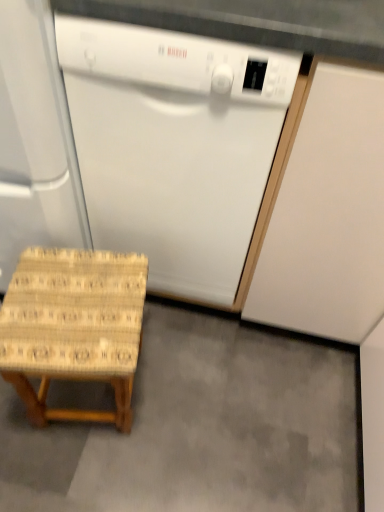
Question: Considering the relative sizes of woven wood stool at lower left and woven wood stool at lower left in the image provided, is woven wood stool at lower left taller than woven wood stool at lower left?

Choices:
 (A) no
 (B) yes

Answer: (B)

Question: Could you tell me if woven wood stool at lower left is facing woven wood stool at lower left?

Choices:
 (A) yes
 (B) no

Answer: (B)

Question: Is woven wood stool at lower left smaller than woven wood stool at lower left?

Choices:
 (A) yes
 (B) no

Answer: (B)

Question: Is woven wood stool at lower left placed right next to woven wood stool at lower left?

Choices:
 (A) yes
 (B) no

Answer: (B)

Question: Can we say woven wood stool at lower left lies outside woven wood stool at lower left?

Choices:
 (A) no
 (B) yes

Answer: (B)

Question: Is white matte dishwasher at left in front of or behind woven wood stool at lower left in the image?

Choices:
 (A) behind
 (B) front

Answer: (B)

Question: Is point (6, 118) positioned closer to the camera than point (44, 387)?

Choices:
 (A) farther
 (B) closer

Answer: (B)

Question: From a real-world perspective, is white matte dishwasher at left positioned above or below woven wood stool at lower left?

Choices:
 (A) above
 (B) below

Answer: (A)

Question: Looking at the image, does white matte dishwasher at left seem bigger or smaller compared to woven wood stool at lower left?

Choices:
 (A) big
 (B) small

Answer: (A)

Question: Looking at their shapes, would you say woven wood stool at lower left is wider or thinner than white glossy dishwasher at center?

Choices:
 (A) wide
 (B) thin

Answer: (A)

Question: Relative to white glossy dishwasher at center, is woven wood stool at lower left in front or behind?

Choices:
 (A) behind
 (B) front

Answer: (A)

Question: Is woven wood stool at lower left bigger or smaller than white glossy dishwasher at center?

Choices:
 (A) big
 (B) small

Answer: (B)

Question: Is woven wood stool at lower left spatially inside white glossy dishwasher at center, or outside of it?

Choices:
 (A) inside
 (B) outside

Answer: (B)

Question: From a real-world perspective, relative to white matte cabinet at right, is white glossy dishwasher at center vertically above or below?

Choices:
 (A) above
 (B) below

Answer: (A)

Question: Is white glossy dishwasher at center wider or thinner than white matte cabinet at right?

Choices:
 (A) thin
 (B) wide

Answer: (A)